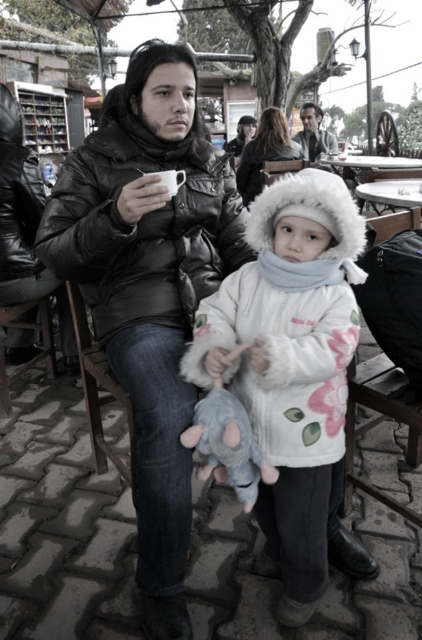
Question: Is white fluffy coat at center smaller than white fur coat at center?

Choices:
 (A) no
 (B) yes

Answer: (B)

Question: Does wooden at left appear on the right side of white fur coat at center?

Choices:
 (A) yes
 (B) no

Answer: (B)

Question: Considering the real-world distances, which object is farthest from the white glossy picnic table at upper center?

Choices:
 (A) white fur coat at center
 (B) wooden at left
 (C) white fluffy coat at center

Answer: (B)

Question: Among these points, which one is farthest from the camera?

Choices:
 (A) (278, 141)
 (B) (359, 195)

Answer: (A)

Question: Does white fluffy coat at center come in front of white glossy picnic table at upper center?

Choices:
 (A) no
 (B) yes

Answer: (B)

Question: Which object is closer to the camera taking this photo?

Choices:
 (A) wooden at left
 (B) plush gray mouse at center

Answer: (B)